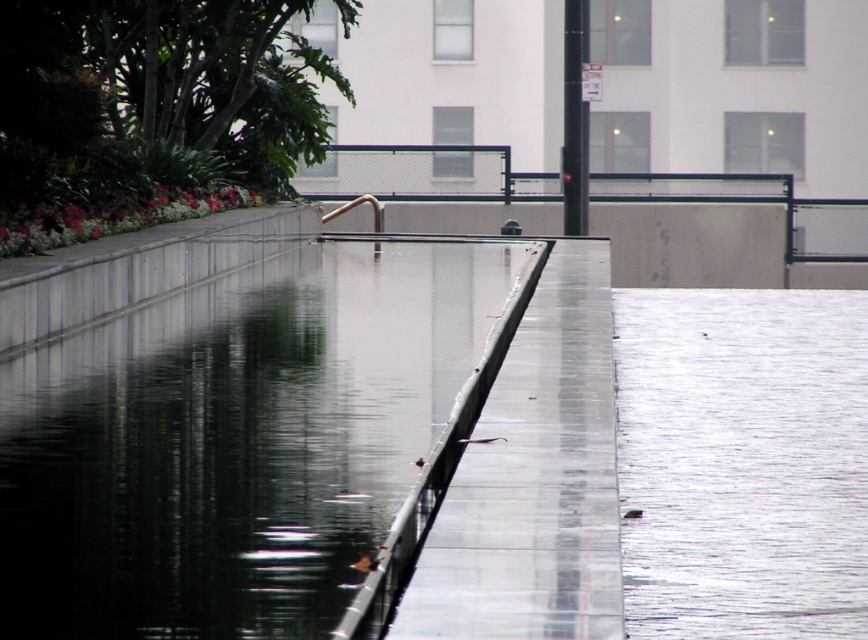
Question: Can you confirm if transparent glass water at center is positioned above glossy concrete pavement at lower right?

Choices:
 (A) yes
 (B) no

Answer: (A)

Question: Does transparent glass water at center have a lesser width compared to glossy concrete pavement at lower right?

Choices:
 (A) no
 (B) yes

Answer: (B)

Question: From the image, what is the correct spatial relationship of transparent glass water at center in relation to glossy concrete pavement at lower right?

Choices:
 (A) right
 (B) left

Answer: (B)

Question: Which point appears closest to the camera in this image?

Choices:
 (A) (755, 577)
 (B) (136, 388)

Answer: (A)

Question: Which point appears farthest from the camera in this image?

Choices:
 (A) (347, 588)
 (B) (622, 358)

Answer: (B)